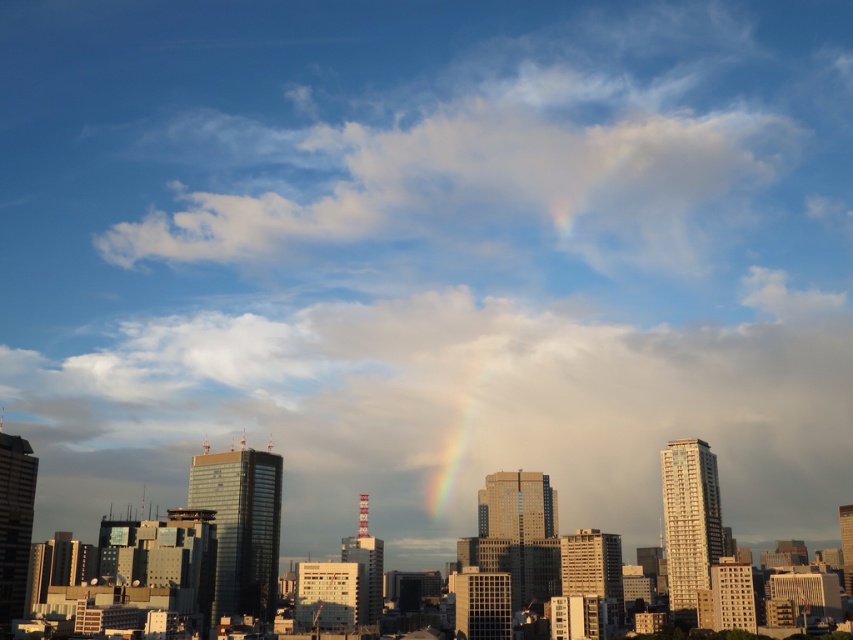
Is cloudy sky at center further to the viewer compared to rainbow at center?

No, it is in front of rainbow at center.

You are a GUI agent. You are given a task and a screenshot of the screen. Output one action in this format:
    pyautogui.click(x=<x>, y=<y>)
    Task: Click on the cloudy sky at center
    The height and width of the screenshot is (640, 853).
    Given the screenshot: What is the action you would take?
    pyautogui.click(x=450, y=412)

Is point (177, 349) less distant than point (235, 209)?

That is True.

Is point (288, 461) positioned behind point (613, 221)?

No.

Is point (807, 417) farther from viewer compared to point (231, 198)?

That is True.

You are a GUI agent. You are given a task and a screenshot of the screen. Output one action in this format:
    pyautogui.click(x=<x>, y=<y>)
    Task: Click on the cloudy sky at center
    The image size is (853, 640).
    Given the screenshot: What is the action you would take?
    pyautogui.click(x=450, y=412)

Which is behind, point (378, 232) or point (474, 436)?

The point (378, 232) is more distant.

Between point (421, 221) and point (463, 454), which one is positioned in front?

Point (463, 454)

Between point (670, 257) and point (474, 412), which one is positioned in front?

Point (474, 412) is more forward.

This screenshot has width=853, height=640. Identify the location of white fluffy cloud at upper center. (496, 182).